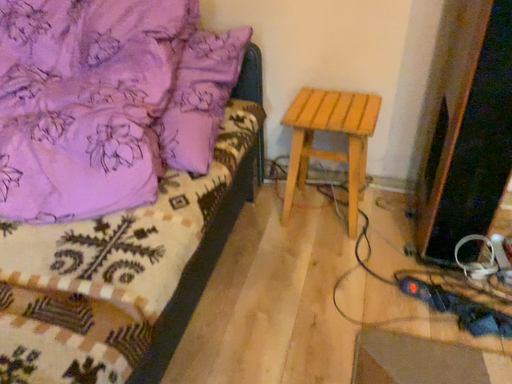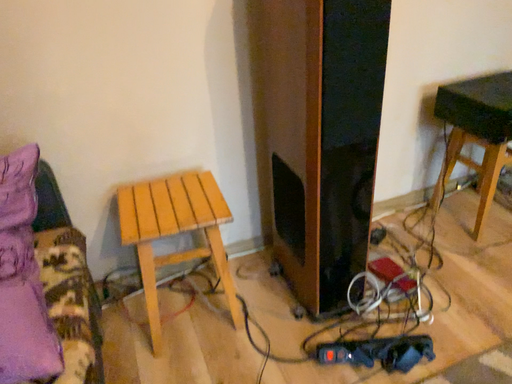
Question: How did the camera likely rotate when shooting the video?

Choices:
 (A) rotated right
 (B) rotated left

Answer: (A)